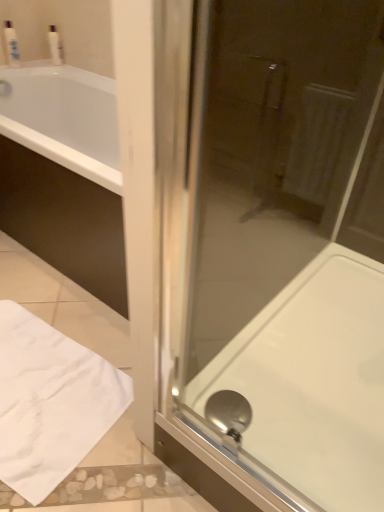
Locate an element on the screen. Image resolution: width=384 pixels, height=512 pixels. vacant area that lies between white plastic bottle at upper left, the first toiletry viewed from the left, and white glossy bottle at upper left, the first toiletry viewed from the right is located at coordinates (33, 67).